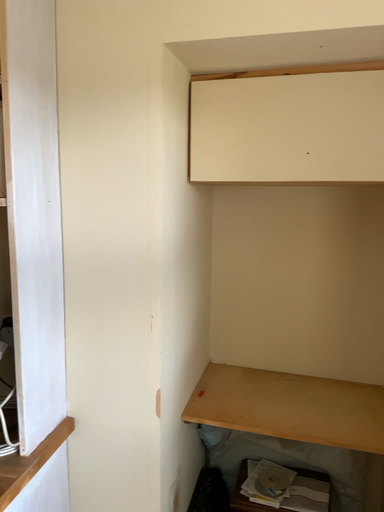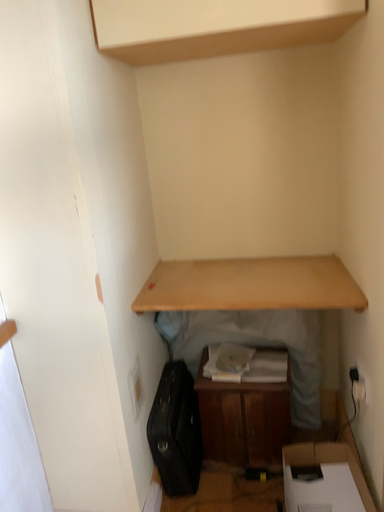
Question: Which way did the camera rotate in the video?

Choices:
 (A) rotated downward
 (B) rotated upward

Answer: (A)